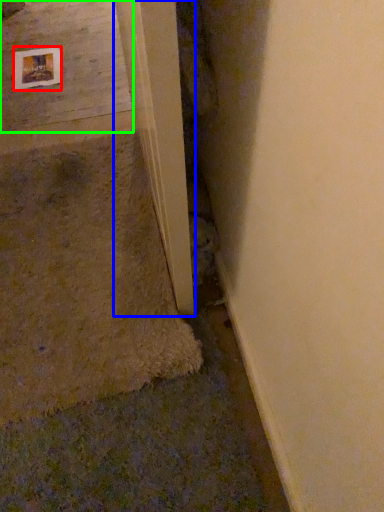
Question: Estimate the real-world distances between objects in this image. Which object is closer to picture frame (highlighted by a red box), beam (highlighted by a blue box) or concrete (highlighted by a green box)?

Choices:
 (A) beam
 (B) concrete

Answer: (B)